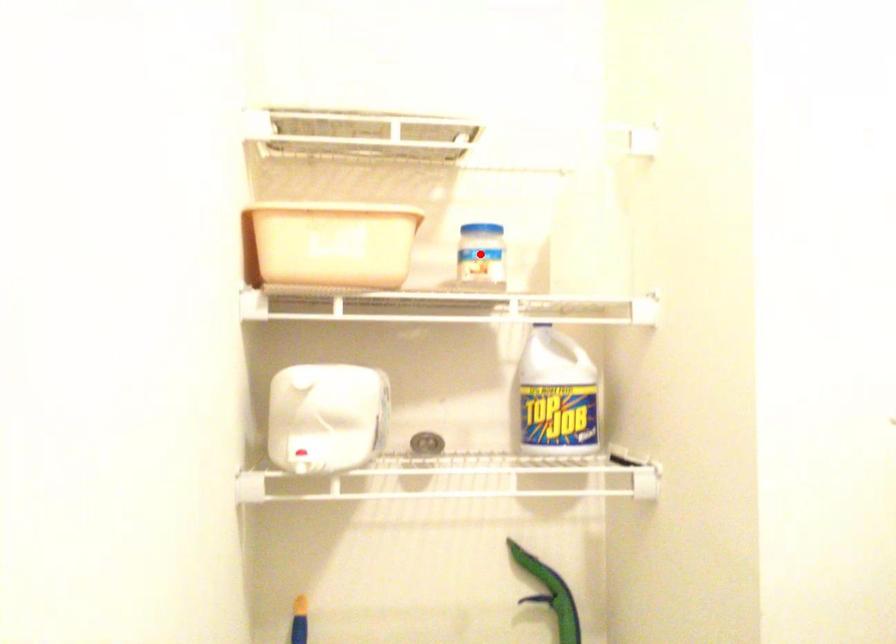
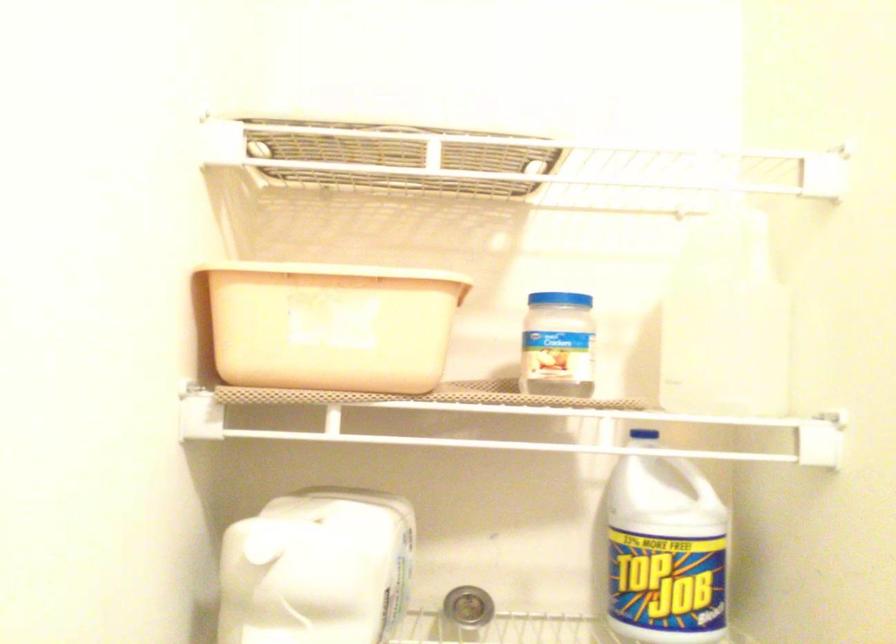
Question: I am providing you with two images of the same scene from different viewpoints. In image1, a red point is highlighted. Considering the same 3D point in image2, which of the following is correct?

Choices:
 (A) It is closer
 (B) It is farther

Answer: (A)